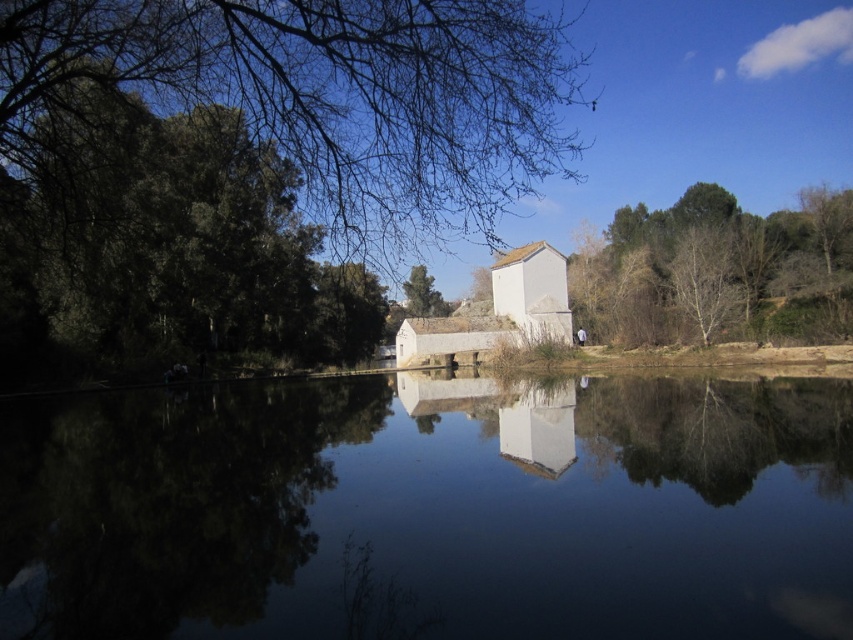
You are standing at the riverside and want to locate two specific points in the scene. The first point is at coordinates point (18, 472) and the second is at point (711, 205). Which of these two points is nearer to your current position?

Point (18, 472) is closer to the viewer than point (711, 205), so the first point is nearer to your current position.

You are standing on the riverside path and see the green leafy tree at upper left and the green leafy tree at right. Which tree is closer to your left side?

The green leafy tree at upper left is closer to your left side because it is positioned to the left of the green leafy tree at right.